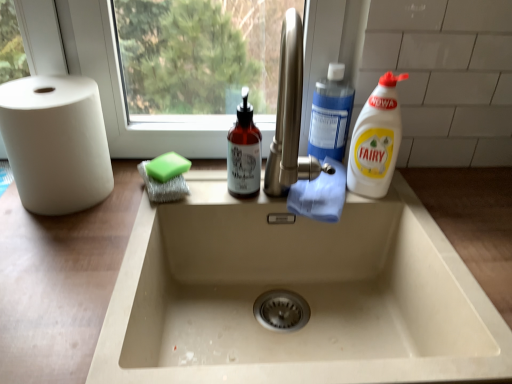
Question: From the image's perspective, is white plastic bottle at right, positioned as the 1th cleaning product in right-to-left order, on translucent amber bottle at center, which is the 3th cleaning product in right-to-left order?

Choices:
 (A) yes
 (B) no

Answer: (A)

Question: From a real-world perspective, is white plastic bottle at right, positioned as the 1th cleaning product in right-to-left order, over translucent amber bottle at center, which is the 3th cleaning product in right-to-left order?

Choices:
 (A) yes
 (B) no

Answer: (A)

Question: Is the depth of white plastic bottle at right, marked as the third cleaning product in a left-to-right arrangement, greater than that of translucent amber bottle at center, the first cleaning product in the left-to-right sequence?

Choices:
 (A) yes
 (B) no

Answer: (B)

Question: Does white plastic bottle at right, marked as the third cleaning product in a left-to-right arrangement, have a greater height compared to translucent amber bottle at center, which is the 3th cleaning product in right-to-left order?

Choices:
 (A) no
 (B) yes

Answer: (B)

Question: Is white plastic bottle at right, positioned as the 1th cleaning product in right-to-left order, shorter than translucent amber bottle at center, the first cleaning product in the left-to-right sequence?

Choices:
 (A) yes
 (B) no

Answer: (B)

Question: From a real-world perspective, is translucent amber bottle at center, the first cleaning product in the left-to-right sequence, positioned above or below blue plastic bottle at upper right, which is counted as the second cleaning product, starting from the left?

Choices:
 (A) above
 (B) below

Answer: (B)

Question: Is point (257, 155) closer or farther from the camera than point (342, 87)?

Choices:
 (A) farther
 (B) closer

Answer: (B)

Question: In the image, is translucent amber bottle at center, the first cleaning product in the left-to-right sequence, positioned in front of or behind blue plastic bottle at upper right, which is counted as the second cleaning product, starting from the left?

Choices:
 (A) behind
 (B) front

Answer: (B)

Question: Looking at the image, does translucent amber bottle at center, the first cleaning product in the left-to-right sequence, seem bigger or smaller compared to blue plastic bottle at upper right, acting as the second cleaning product starting from the right?

Choices:
 (A) big
 (B) small

Answer: (B)

Question: Choose the correct answer: Is translucent amber bottle at center, which is the 3th cleaning product in right-to-left order, inside green sponge at upper left or outside it?

Choices:
 (A) inside
 (B) outside

Answer: (B)

Question: From their relative heights in the image, would you say translucent amber bottle at center, the first cleaning product in the left-to-right sequence, is taller or shorter than green sponge at upper left?

Choices:
 (A) tall
 (B) short

Answer: (A)

Question: From a real-world perspective, is translucent amber bottle at center, the first cleaning product in the left-to-right sequence, physically located above or below green sponge at upper left?

Choices:
 (A) below
 (B) above

Answer: (B)

Question: In terms of width, does translucent amber bottle at center, the first cleaning product in the left-to-right sequence, look wider or thinner when compared to green sponge at upper left?

Choices:
 (A) wide
 (B) thin

Answer: (B)

Question: Is point (330, 89) closer or farther from the camera than point (366, 163)?

Choices:
 (A) closer
 (B) farther

Answer: (B)

Question: Is blue plastic bottle at upper right, which is counted as the second cleaning product, starting from the left, situated inside white plastic bottle at right, marked as the third cleaning product in a left-to-right arrangement, or outside?

Choices:
 (A) outside
 (B) inside

Answer: (A)